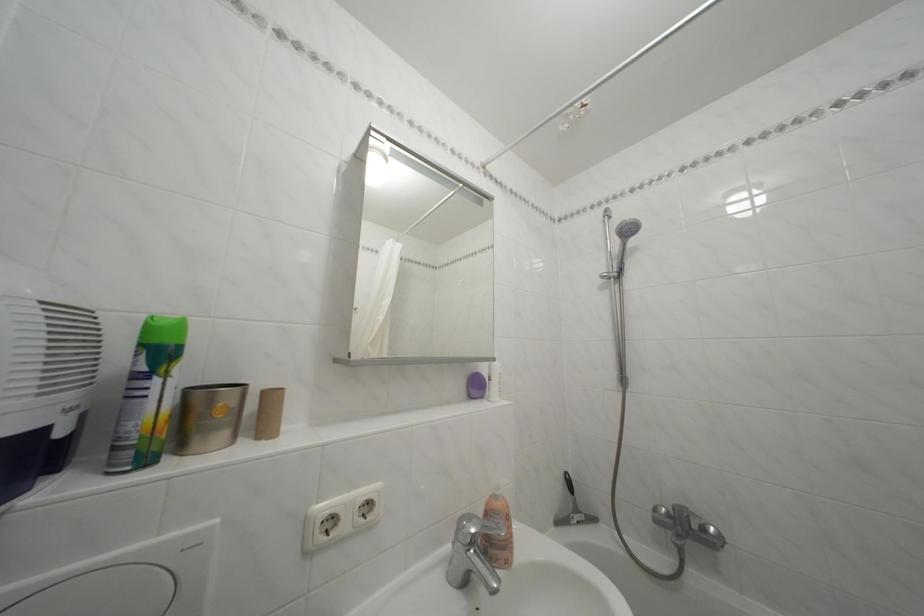
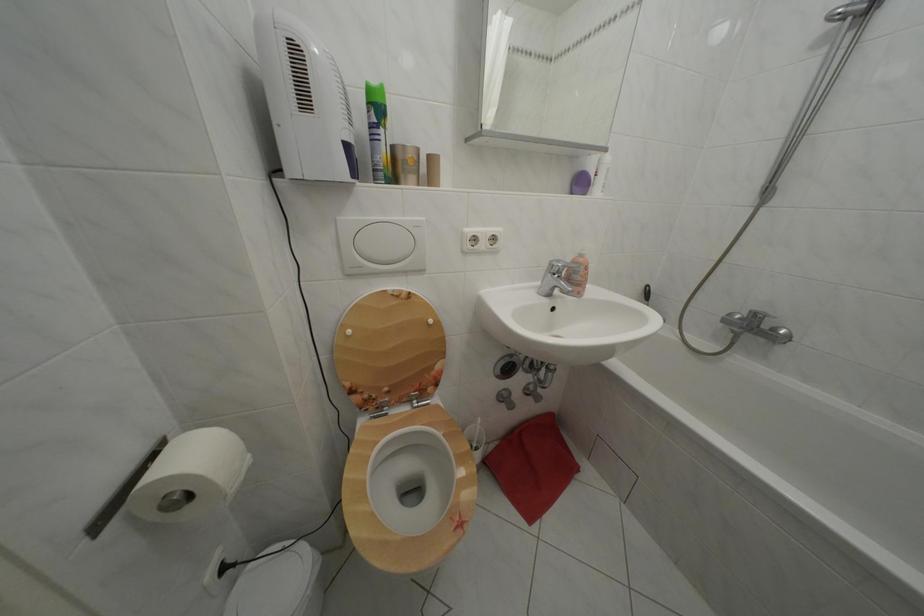
In the second image, find the point that corresponds to pixel 150 351 in the first image.

(378, 110)